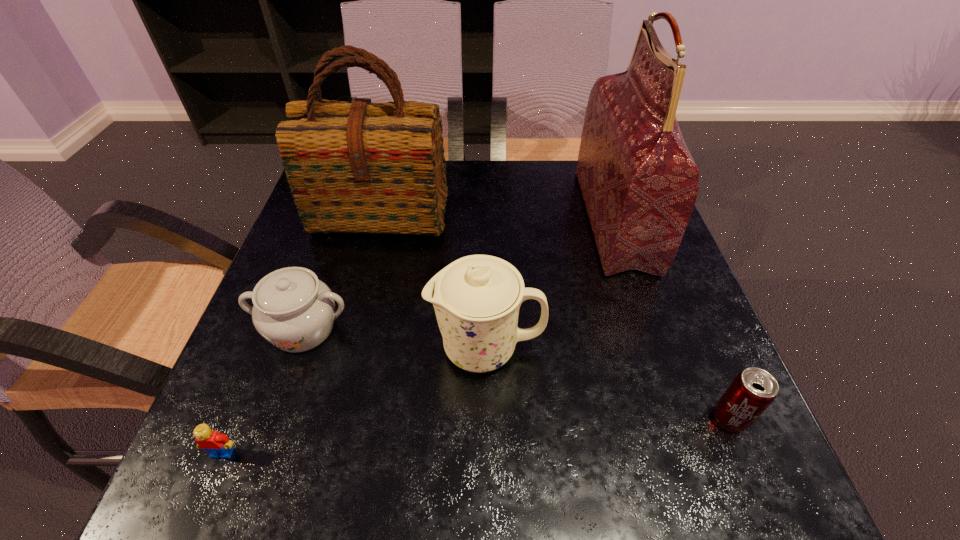
In order to click on blank space located on the front-facing side of the handbag in this screenshot , I will do `click(516, 219)`.

Image resolution: width=960 pixels, height=540 pixels. Identify the location of vacant space located on the front-facing side of the handbag. (536, 219).

The image size is (960, 540). Find the location of `blank space located 0.340m on the front-facing side of the handbag`. blank space located 0.340m on the front-facing side of the handbag is located at coordinates (451, 219).

Locate an element on the screen. The height and width of the screenshot is (540, 960). vacant space located 0.210m on the open handle side of the second tallest object is located at coordinates (354, 314).

You are a GUI agent. You are given a task and a screenshot of the screen. Output one action in this format:
    pyautogui.click(x=<x>, y=<y>)
    Task: Click on the blank area located on the spout of the fourth shortest object
    
    Given the screenshot: What is the action you would take?
    pyautogui.click(x=397, y=348)

The height and width of the screenshot is (540, 960). Find the location of `free region located 0.090m on the spout of the fourth shortest object`. free region located 0.090m on the spout of the fourth shortest object is located at coordinates (381, 348).

This screenshot has width=960, height=540. I want to click on free space located 0.070m on the spout of the fourth shortest object, so click(x=392, y=348).

Identify the location of vacant space located on the right of the shorter chinaware. The width and height of the screenshot is (960, 540). (394, 329).

Find the location of a particular element. vacant region located on the back of the beer can is located at coordinates (704, 353).

This screenshot has width=960, height=540. In order to click on free region located on the face of the nearest object in this screenshot , I will do `click(206, 493)`.